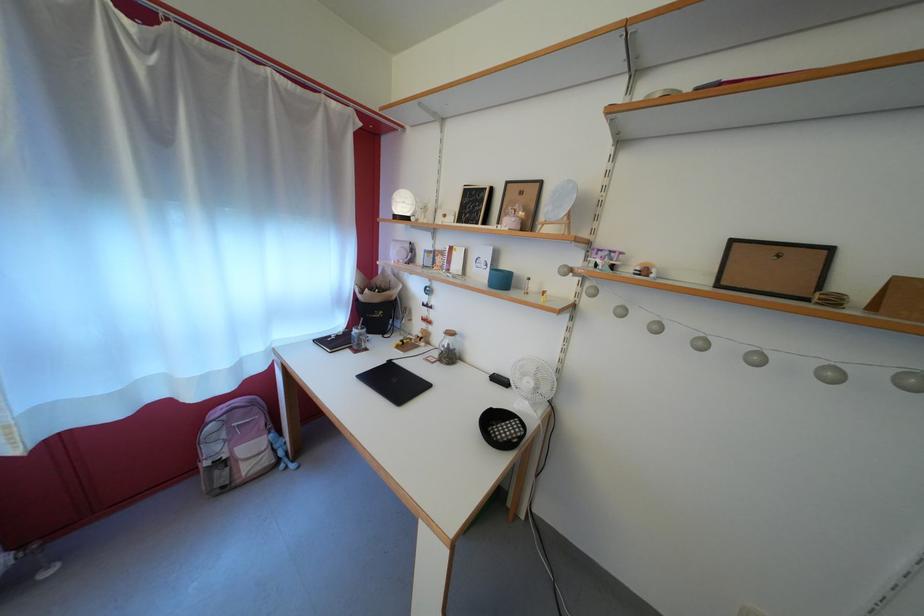
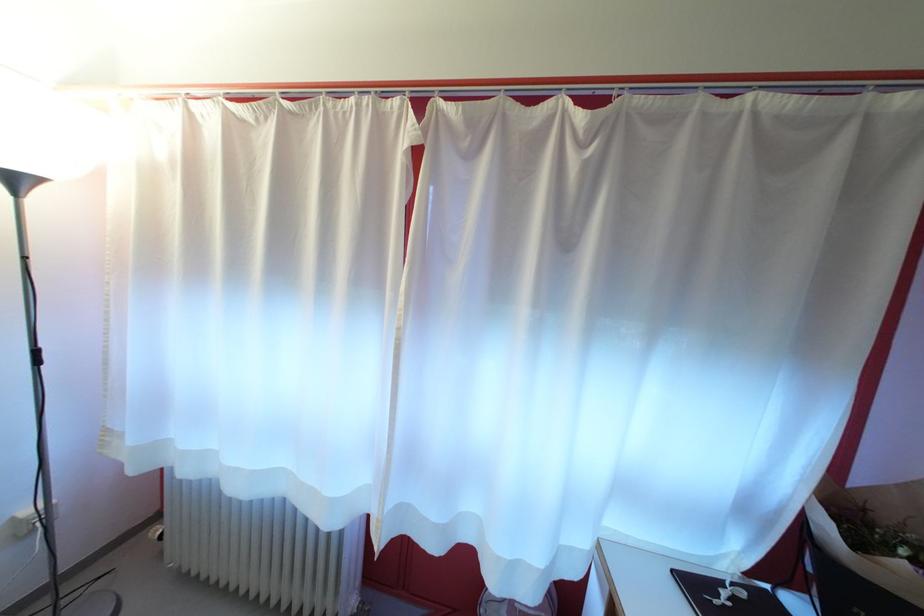
Question: How did the camera likely rotate?

Choices:
 (A) Left
 (B) Right
 (C) Up
 (D) Down

Answer: (A)